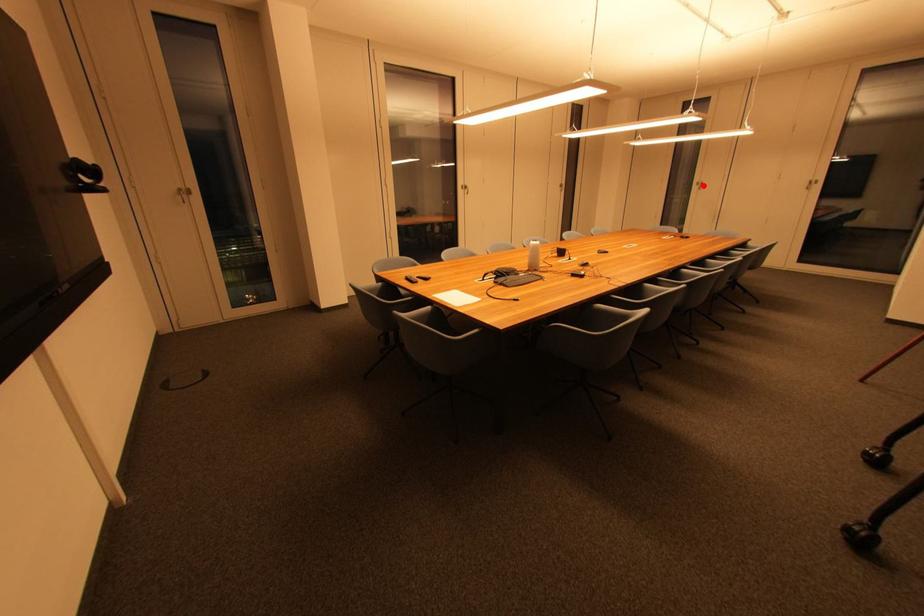
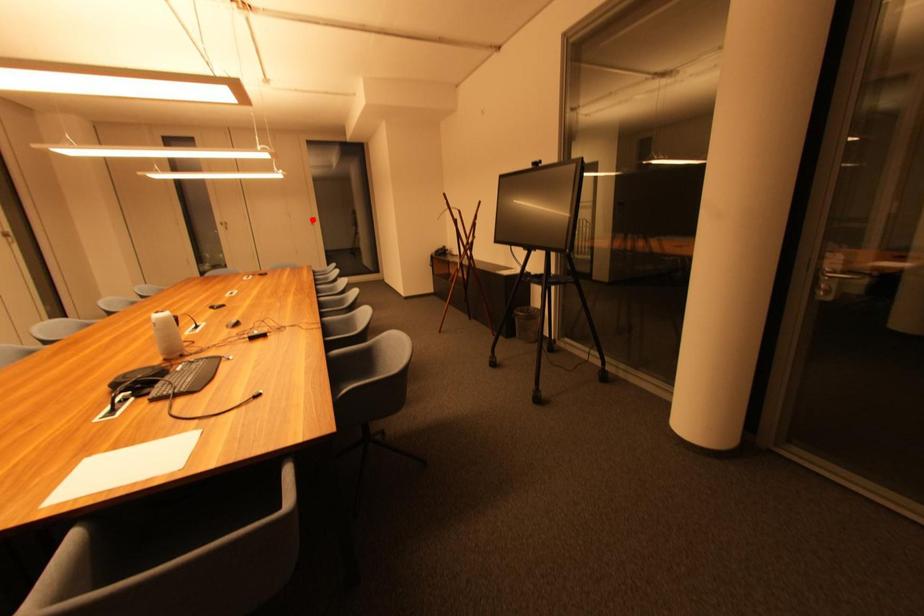
I am providing you with two images of the same scene from different viewpoints. A red point is marked on the first image and another point is marked on the second image. Are the points marked in image1 and image2 representing the same 3D position?

No